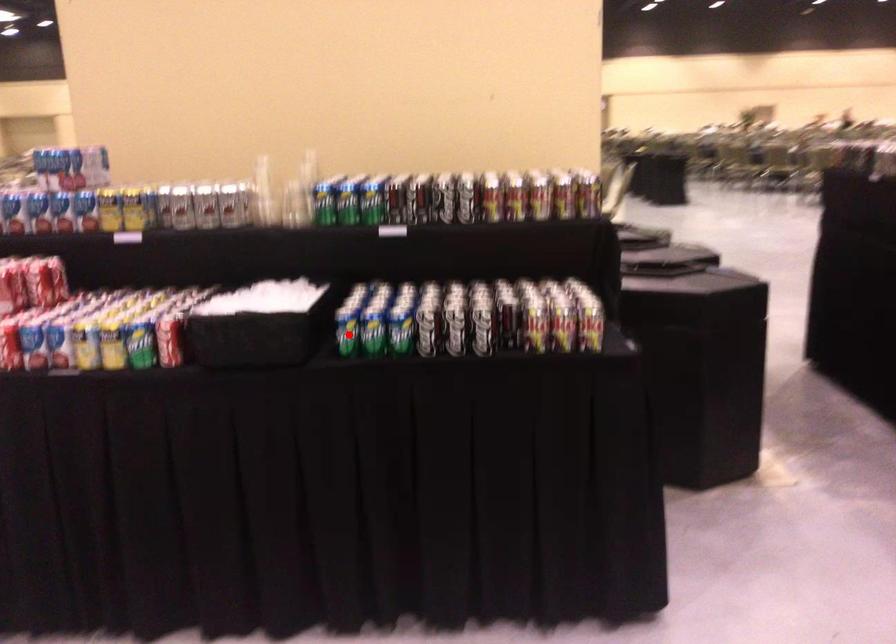
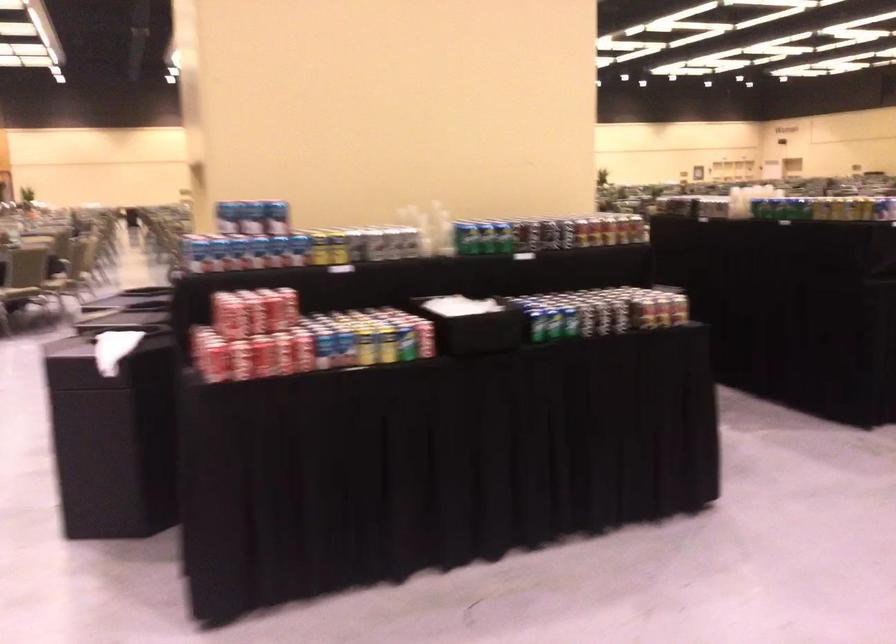
Where in the second image is the point corresponding to the highlighted location from the first image?

(539, 326)